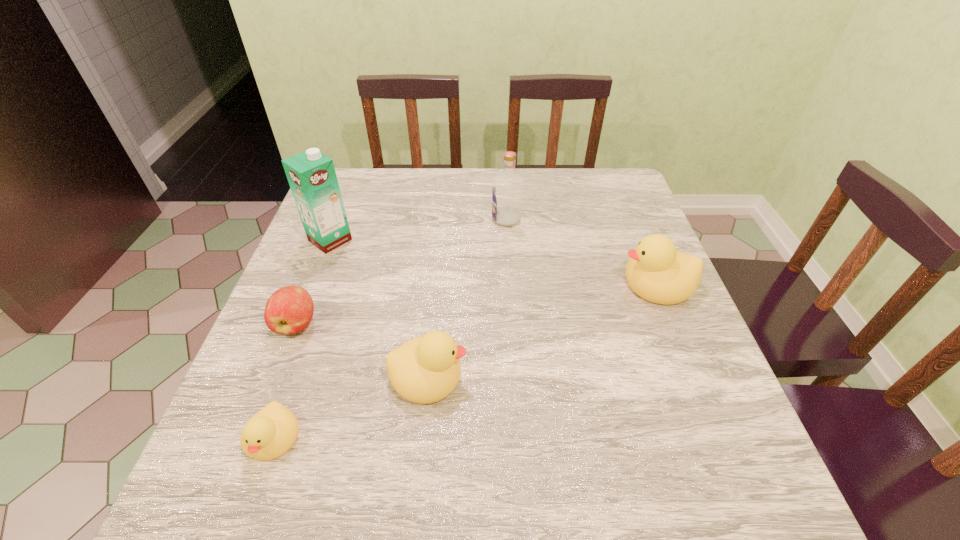
Identify the location of duckling that is the closest to the rightmost object. The width and height of the screenshot is (960, 540). (426, 369).

Identify which duckling is located as the third nearest to the carton. Please provide its 2D coordinates. Your answer should be formatted as a tuple, i.e. [(x, y)], where the tuple contains the x and y coordinates of a point satisfying the conditions above.

[(656, 271)]

This screenshot has height=540, width=960. I want to click on vacant space that satisfies the following two spatial constraints: 1. on the face of the second farthest duckling; 2. on the face of the shortest duckling, so click(x=421, y=438).